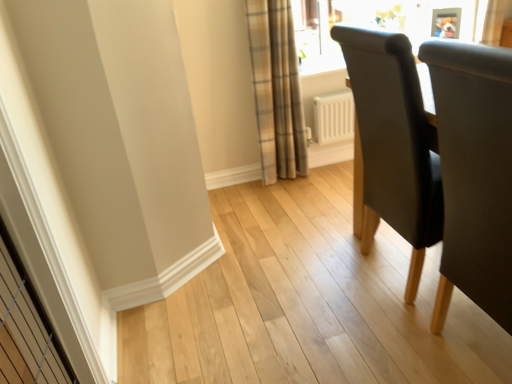
Where is `vacant region under dark gray fabric chair at right, the 2th chair viewed from the front (from a real-world perspective)`? This screenshot has height=384, width=512. vacant region under dark gray fabric chair at right, the 2th chair viewed from the front (from a real-world perspective) is located at coordinates point(389,273).